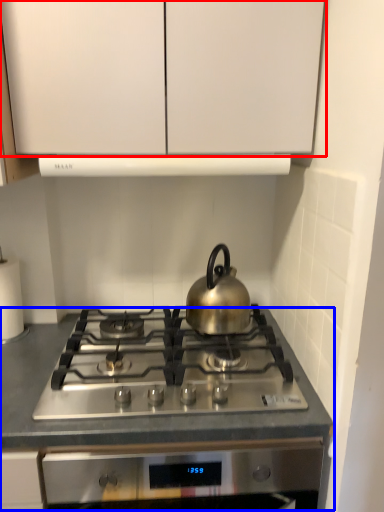
Question: Which object is further to the camera taking this photo, cabinetry (highlighted by a red box) or counter (highlighted by a blue box)?

Choices:
 (A) cabinetry
 (B) counter

Answer: (B)